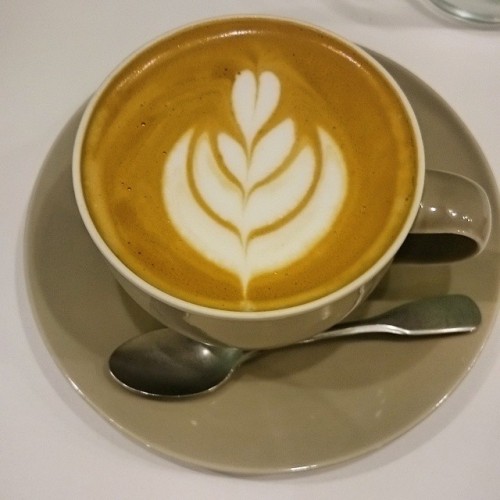
At what (x,y) coordinates should I click in order to perform the action: click on grey plate. Please return your answer as a coordinate pair (x, y). This screenshot has height=500, width=500. Looking at the image, I should click on 295,427, 360,427.